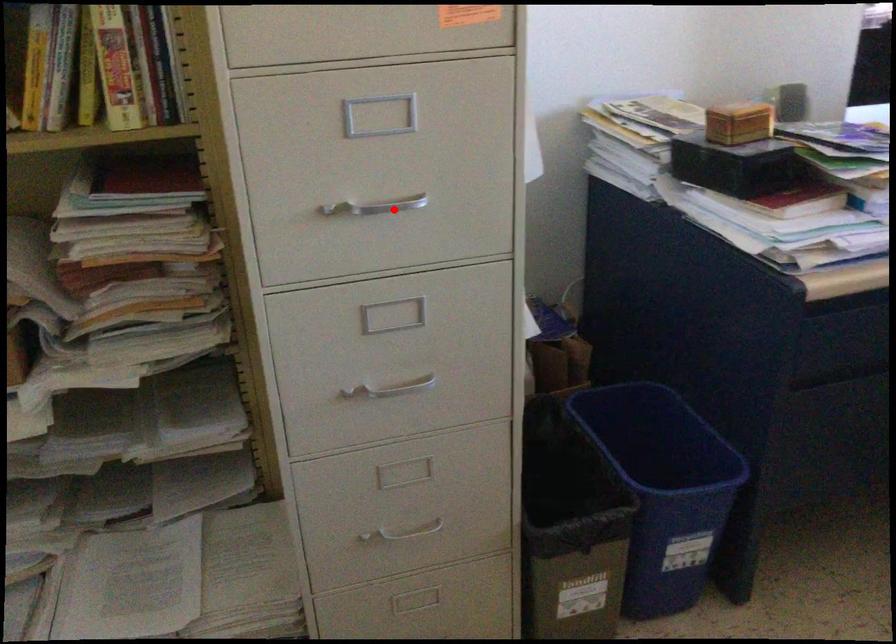
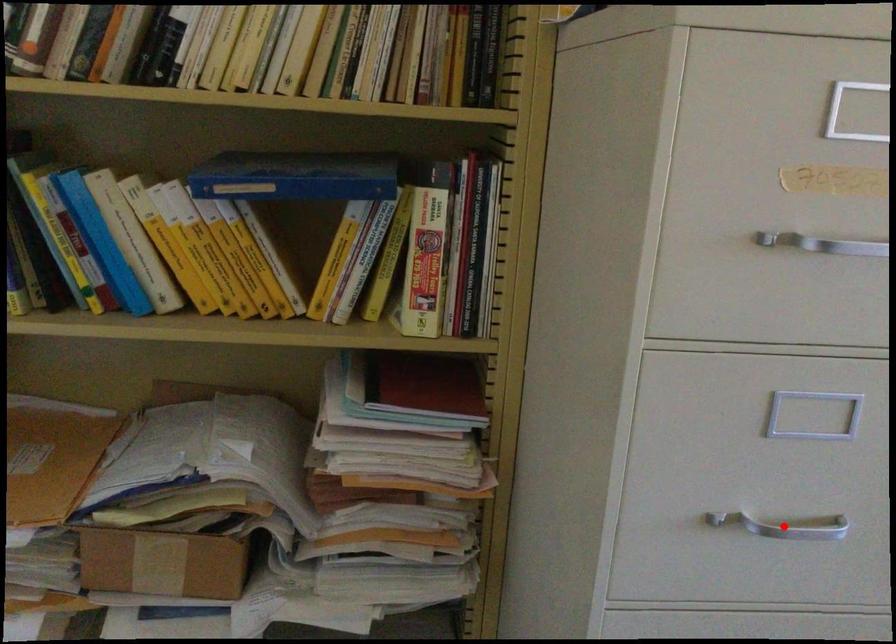
I am providing you with two images of the same scene from different viewpoints. A red point is marked on the first image and another point is marked on the second image. Do the highlighted points in image1 and image2 indicate the same real-world spot?

Yes